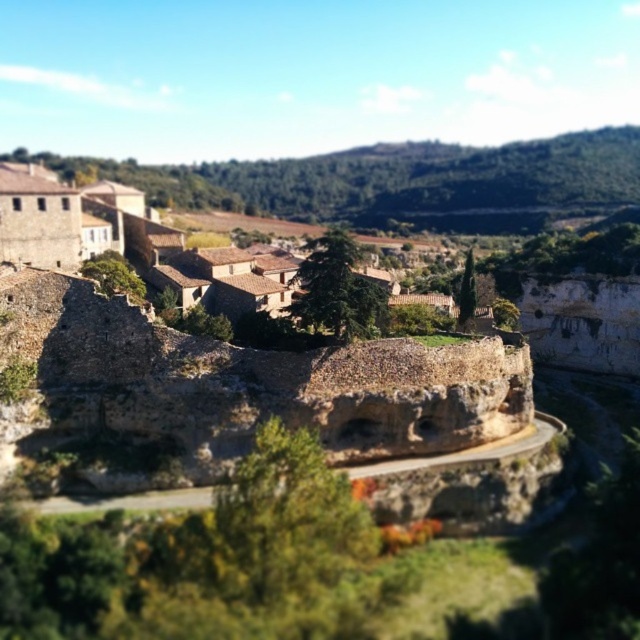
Question: Is brown rough stone wall at center further to the viewer compared to brown stone village at upper left?

Choices:
 (A) yes
 (B) no

Answer: (B)

Question: Which point appears farthest from the camera in this image?

Choices:
 (A) (83, 202)
 (B) (28, 305)

Answer: (A)

Question: Can you confirm if brown rough stone wall at center is bigger than brown stone village at upper left?

Choices:
 (A) yes
 (B) no

Answer: (B)

Question: Is brown rough stone wall at center above brown stone village at upper left?

Choices:
 (A) no
 (B) yes

Answer: (A)

Question: Among these objects, which one is nearest to the camera?

Choices:
 (A) brown rough stone wall at center
 (B) brown stone village at upper left

Answer: (A)